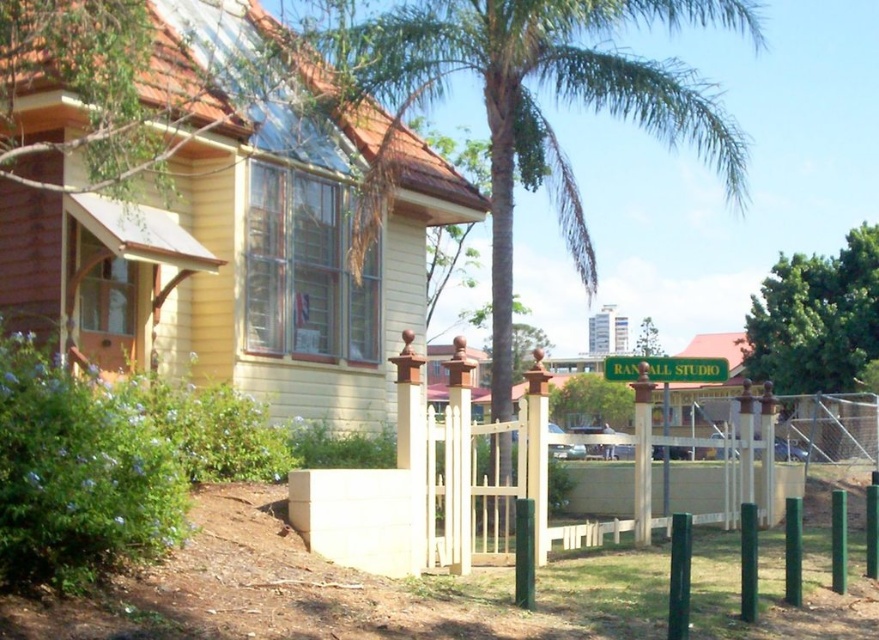
You are a landscape designer planning to add a new tree to the garden. You have two options based on the scene. Which tree between the green leafy palm tree at center and the green leafy tree at right would you choose if you want a wider tree for shade?

The green leafy palm tree at center has a larger width than the green leafy tree at right, so it would be the better choice for a wider tree providing shade.

You are standing in front of the house and see two points marked in the image. The first point is at coordinates point (491, 189) and the second is at point (821, 342). Which point is closer to you?

Point (491, 189) is closer to the viewer than point (821, 342).